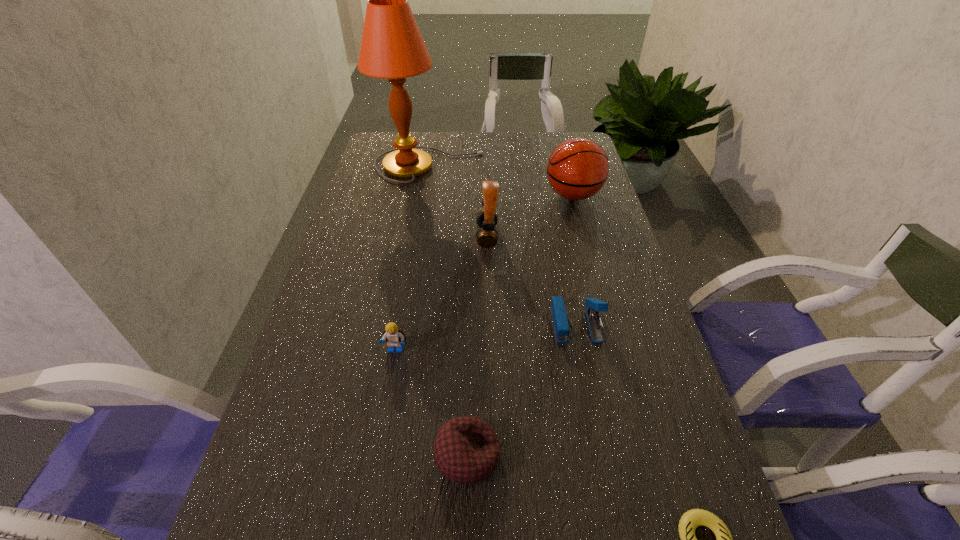
Find the location of a particular element. The width and height of the screenshot is (960, 540). stapler that is at the right edge is located at coordinates tap(593, 306).

The image size is (960, 540). Find the location of `object that is at the far left corner`. object that is at the far left corner is located at coordinates (392, 47).

Identify the location of free space at the far edge of the desktop. The image size is (960, 540). (500, 136).

Find the location of `free space at the left edge of the desktop`. free space at the left edge of the desktop is located at coordinates (373, 173).

What are the coordinates of `free region at the right edge` in the screenshot? It's located at (594, 206).

This screenshot has height=540, width=960. In order to click on empty location between the stapler and the fifth nearest object in this screenshot , I will do `click(532, 280)`.

Locate an element on the screen. This screenshot has width=960, height=540. vacant point located between the fifth nearest object and the lamp is located at coordinates (458, 201).

You are a GUI agent. You are given a task and a screenshot of the screen. Output one action in this format:
    pyautogui.click(x=<x>, y=<y>)
    Task: Click on the free spot between the stapler and the headset
    This screenshot has width=960, height=540.
    Given the screenshot: What is the action you would take?
    pyautogui.click(x=532, y=280)

Image resolution: width=960 pixels, height=540 pixels. What are the coordinates of `vacant space that's between the stapler and the lamp` in the screenshot? It's located at (503, 245).

Locate an element on the screen. free space between the stapler and the Lego is located at coordinates (486, 337).